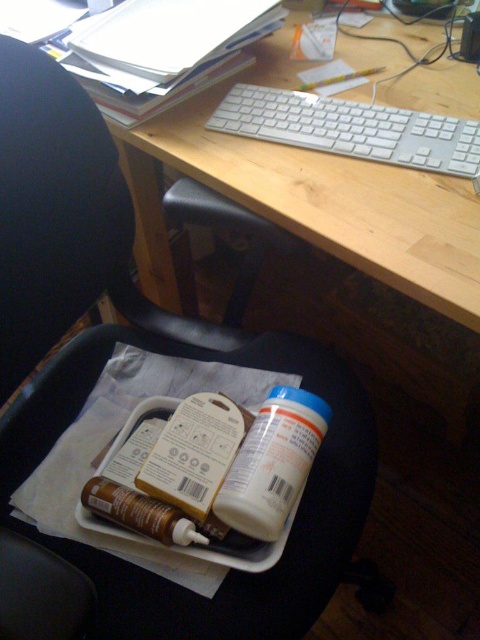
Question: Which is nearer to the white plastic keyboard at upper center?

Choices:
 (A) black plastic swivel chair at lower center
 (B) white matte bottle at lower center

Answer: (A)

Question: Does wooden at upper center have a lesser width compared to white matte bottle at lower center?

Choices:
 (A) yes
 (B) no

Answer: (B)

Question: Which point appears farthest from the camera in this image?

Choices:
 (A) (216, 134)
 (B) (19, 234)
 (C) (326, 419)
 (D) (235, 116)

Answer: (D)

Question: Does wooden at upper center appear on the right side of white matte bottle at lower center?

Choices:
 (A) yes
 (B) no

Answer: (B)

Question: Is wooden at upper center bigger than white plastic keyboard at upper center?

Choices:
 (A) no
 (B) yes

Answer: (B)

Question: Which of these objects is positioned farthest from the white matte bottle at lower center?

Choices:
 (A) white plastic keyboard at upper center
 (B) wooden at upper center

Answer: (A)